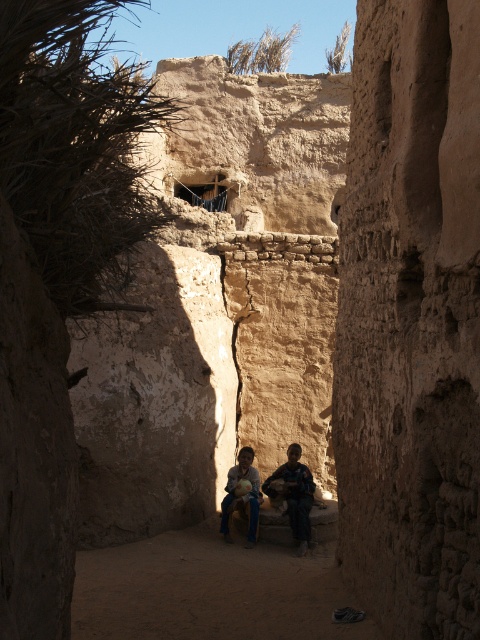
Question: Is brown textured fabric at center in front of matte brown child at center?

Choices:
 (A) yes
 (B) no

Answer: (B)

Question: Which object is closer to the camera taking this photo?

Choices:
 (A) brown textured fabric at center
 (B) brown rough stone alley at center

Answer: (B)

Question: Among these objects, which one is farthest from the camera?

Choices:
 (A) brown rough stone alley at center
 (B) brown textured fabric at center

Answer: (B)

Question: From the image, what is the correct spatial relationship of brown textured fabric at center in relation to matte brown child at center?

Choices:
 (A) below
 (B) above

Answer: (B)

Question: Is brown rough stone alley at center behind brown textured fabric at center?

Choices:
 (A) no
 (B) yes

Answer: (A)

Question: Which of the following is the farthest from the observer?

Choices:
 (A) brown rough stone alley at center
 (B) brown textured fabric at center

Answer: (B)